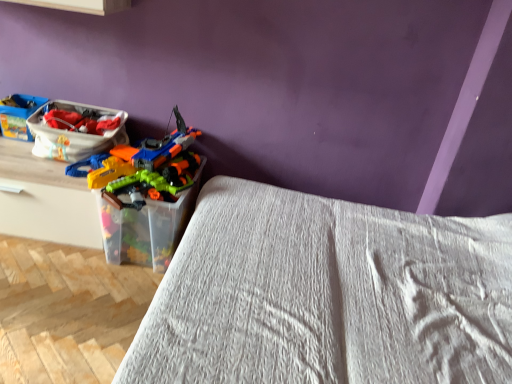
Question: From a real-world perspective, is white textured bed at center physically located above or below translucent plastic container at center?

Choices:
 (A) below
 (B) above

Answer: (B)

Question: Is white textured bed at center to the left or to the right of translucent plastic container at center in the image?

Choices:
 (A) left
 (B) right

Answer: (B)

Question: Which of these objects is positioned farthest from the white textured bed at center?

Choices:
 (A) translucent plastic container at center
 (B) matte plastic toy boat at left, the second kit when ordered from right to left
 (C) matte plastic basket at upper left, the first kit positioned from the right

Answer: (B)

Question: Which object is positioned closest to the matte plastic toy boat at left, marked as the first kit in a left-to-right arrangement?

Choices:
 (A) translucent plastic container at center
 (B) white textured bed at center
 (C) matte plastic basket at upper left, positioned as the second kit in left-to-right order

Answer: (C)